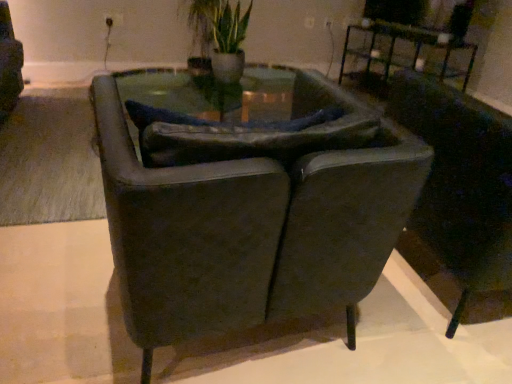
Question: Does dark leather chair at right, which ranks as the 1th chair in right-to-left order, turn towards green leafy plant at upper center?

Choices:
 (A) yes
 (B) no

Answer: (A)

Question: Is dark leather chair at right, the second chair in the left-to-right sequence, far from green leafy plant at upper center?

Choices:
 (A) no
 (B) yes

Answer: (B)

Question: Does dark leather chair at right, the second chair in the left-to-right sequence, appear on the right side of green leafy plant at upper center?

Choices:
 (A) no
 (B) yes

Answer: (B)

Question: Is dark leather chair at right, which ranks as the 1th chair in right-to-left order, next to green leafy plant at upper center and touching it?

Choices:
 (A) no
 (B) yes

Answer: (A)

Question: Does dark leather chair at right, which ranks as the 1th chair in right-to-left order, have a lesser height compared to green leafy plant at upper center?

Choices:
 (A) yes
 (B) no

Answer: (B)

Question: From the image's perspective, relative to metallic black table at upper right, is dark leather chair at right, the second chair in the left-to-right sequence, above or below?

Choices:
 (A) above
 (B) below

Answer: (B)

Question: Is dark leather chair at right, the second chair in the left-to-right sequence, wider or thinner than metallic black table at upper right?

Choices:
 (A) wide
 (B) thin

Answer: (A)

Question: Considering their positions, is dark leather chair at right, which ranks as the 1th chair in right-to-left order, located in front of or behind metallic black table at upper right?

Choices:
 (A) behind
 (B) front

Answer: (B)

Question: Considering the positions of dark leather chair at right, which ranks as the 1th chair in right-to-left order, and metallic black table at upper right in the image, is dark leather chair at right, which ranks as the 1th chair in right-to-left order, taller or shorter than metallic black table at upper right?

Choices:
 (A) tall
 (B) short

Answer: (A)

Question: In terms of height, does metallic black table at upper right look taller or shorter compared to dark leather chair at right, the second chair in the left-to-right sequence?

Choices:
 (A) tall
 (B) short

Answer: (B)

Question: Is metallic black table at upper right bigger or smaller than dark leather chair at right, which ranks as the 1th chair in right-to-left order?

Choices:
 (A) big
 (B) small

Answer: (B)

Question: Is metallic black table at upper right to the left or to the right of dark leather chair at right, which ranks as the 1th chair in right-to-left order, in the image?

Choices:
 (A) left
 (B) right

Answer: (B)

Question: From the image's perspective, is metallic black table at upper right above or below dark leather chair at right, which ranks as the 1th chair in right-to-left order?

Choices:
 (A) above
 (B) below

Answer: (A)

Question: From a real-world perspective, is metallic black table at upper right above or below suede-like dark brown armchair at center, the first chair viewed from the left?

Choices:
 (A) above
 (B) below

Answer: (B)

Question: Is metallic black table at upper right spatially inside suede-like dark brown armchair at center, the first chair viewed from the left, or outside of it?

Choices:
 (A) outside
 (B) inside

Answer: (A)